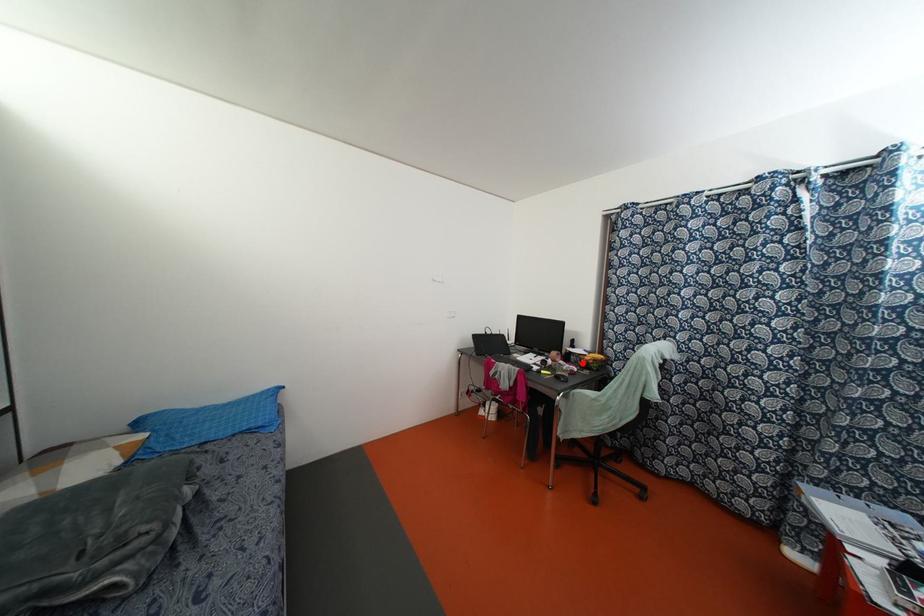
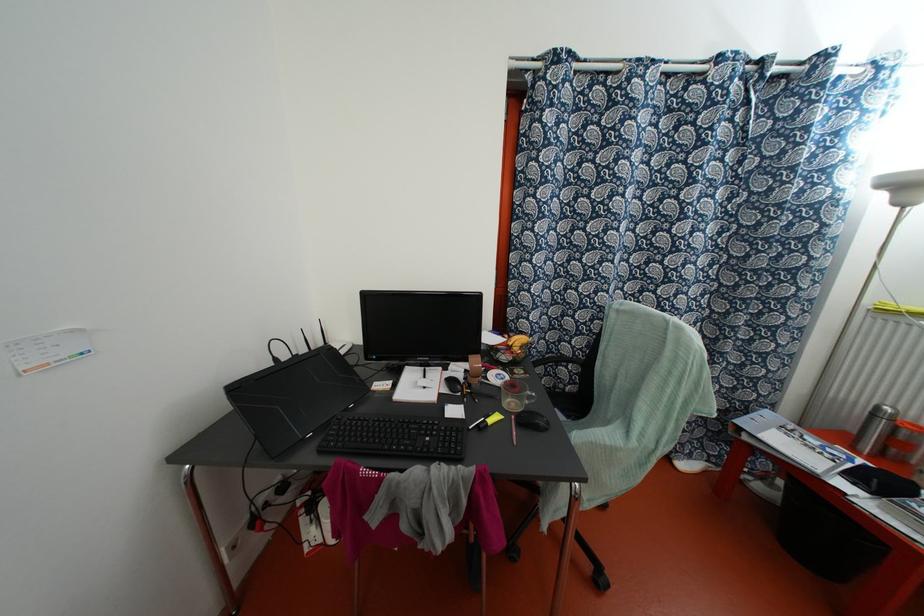
Locate, in the second image, the point that corresponds to the highlighted location in the first image.

(504, 357)